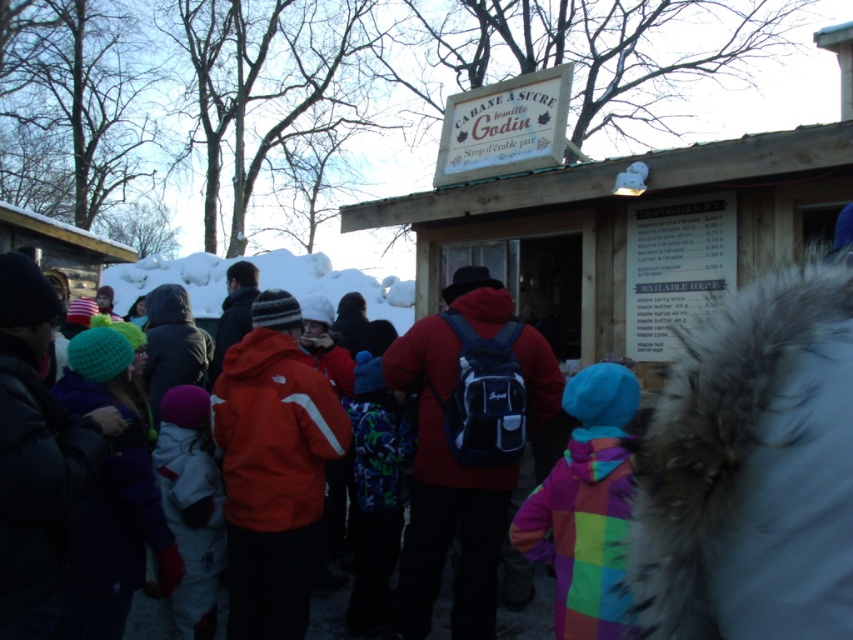
Question: Which object is closer to the camera taking this photo?

Choices:
 (A) white fleece jacket at center
 (B) rainbow fleece jacket at lower right
 (C) wooden hut at center
 (D) white fluffy snow at center

Answer: (B)

Question: Is white fleece jacket at center below white fluffy snow at center?

Choices:
 (A) no
 (B) yes

Answer: (B)

Question: Does wooden hut at center appear under rainbow fleece jacket at lower right?

Choices:
 (A) yes
 (B) no

Answer: (B)

Question: In this image, where is white fleece jacket at center located relative to white fluffy snow at center?

Choices:
 (A) below
 (B) above

Answer: (A)

Question: Considering the real-world distances, which object is farthest from the white fleece jacket at center?

Choices:
 (A) white fluffy snow at center
 (B) printed fabric backpack at center

Answer: (A)

Question: Which point is farther from the camera taking this photo?

Choices:
 (A) (520, 269)
 (B) (593, 435)

Answer: (A)